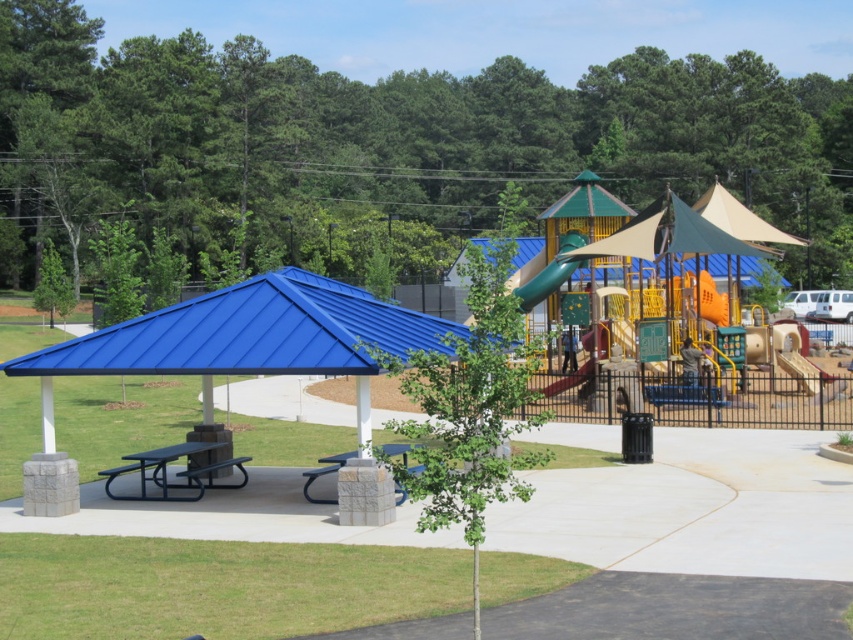
Question: Which point appears farthest from the camera in this image?

Choices:
 (A) (311, 468)
 (B) (140, 356)
 (C) (129, 465)

Answer: (C)

Question: Is blue metal picnic table at lower left bigger than smooth green slide at center?

Choices:
 (A) yes
 (B) no

Answer: (A)

Question: Is blue metal canopy at left to the right of green matte slide at center from the viewer's perspective?

Choices:
 (A) yes
 (B) no

Answer: (B)

Question: Is green matte slide at center below stone textured picnic table at center?

Choices:
 (A) yes
 (B) no

Answer: (B)

Question: Considering the real-world distances, which object is closest to the smooth green slide at center?

Choices:
 (A) green matte slide at center
 (B) blue metal canopy at left
 (C) stone textured picnic table at center
 (D) blue metal picnic table at lower left

Answer: (A)

Question: Which point is closer to the camera taking this photo?

Choices:
 (A) (549, 385)
 (B) (154, 468)

Answer: (B)